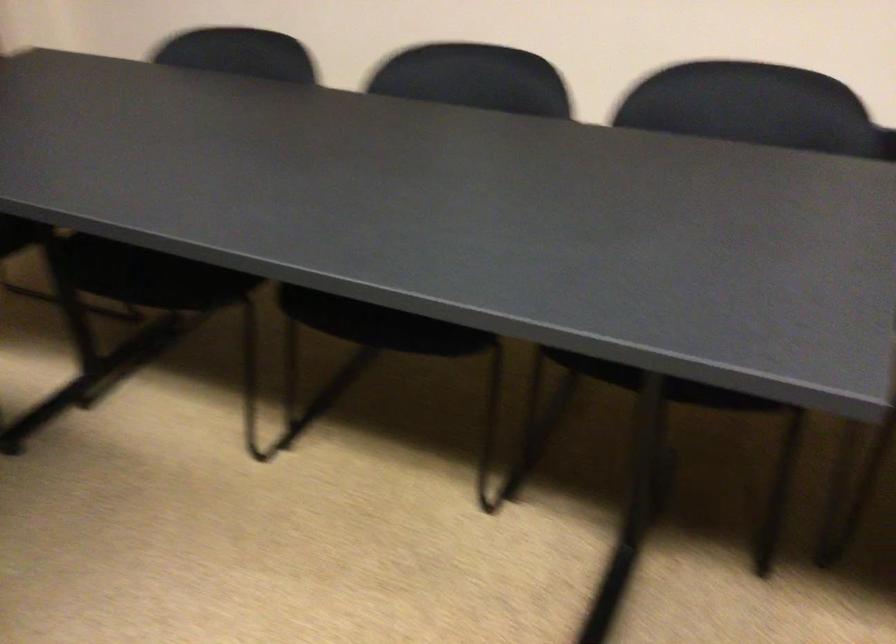
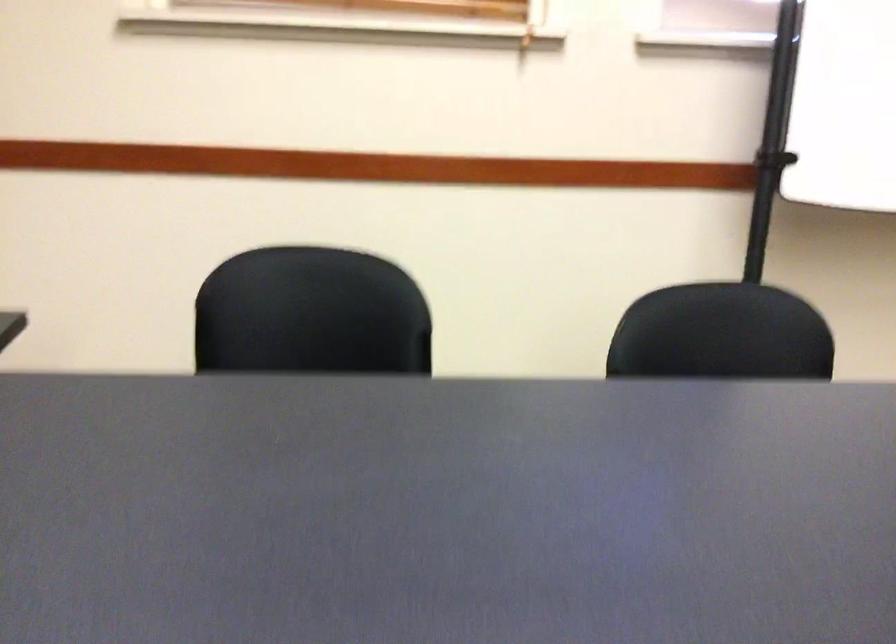
The first image is from the beginning of the video and the second image is from the end. How did the camera likely rotate when shooting the video?

The camera's rotation is toward right-down.